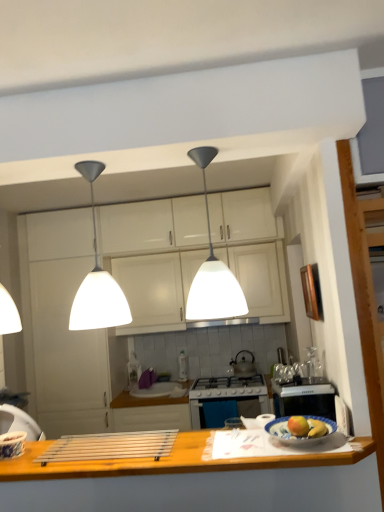
Identify the location of free space to the left of yellow matte apple at center, the 2th apple when ordered from right to left. (252, 442).